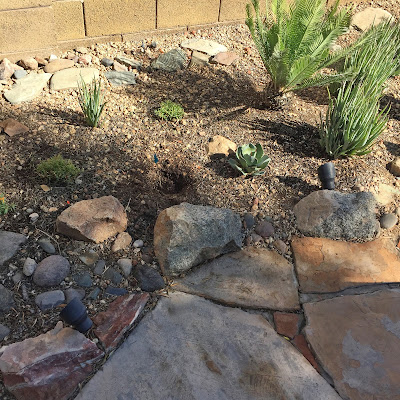
Find the location of a particular element. This screenshot has height=400, width=400. light is located at coordinates (340, 171).